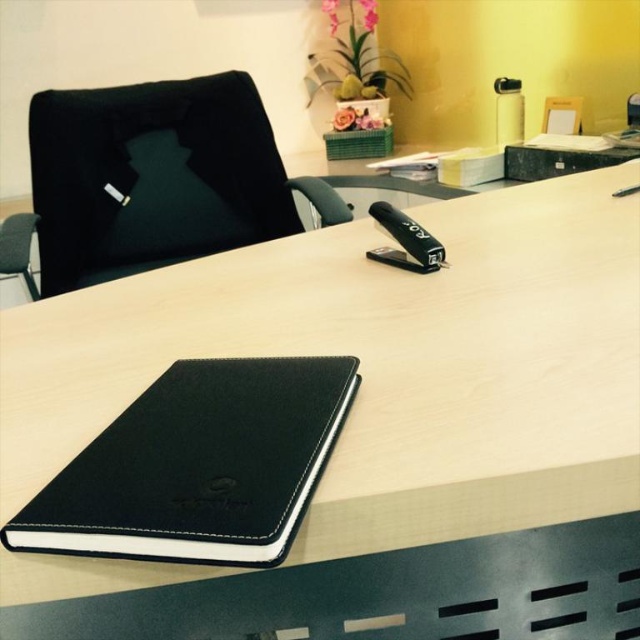
Question: Which of the following is the closest to the observer?

Choices:
 (A) (216, 524)
 (B) (188, 253)

Answer: (A)

Question: Which object appears closest to the camera in this image?

Choices:
 (A) black leather notebook at lower left
 (B) black leather swivel chair at left

Answer: (A)

Question: Can you confirm if black leather notebook at lower left is positioned to the right of black leather swivel chair at left?

Choices:
 (A) yes
 (B) no

Answer: (A)

Question: Does black leather notebook at lower left have a smaller size compared to black leather swivel chair at left?

Choices:
 (A) yes
 (B) no

Answer: (A)

Question: Does black leather notebook at lower left appear on the left side of black leather swivel chair at left?

Choices:
 (A) yes
 (B) no

Answer: (B)